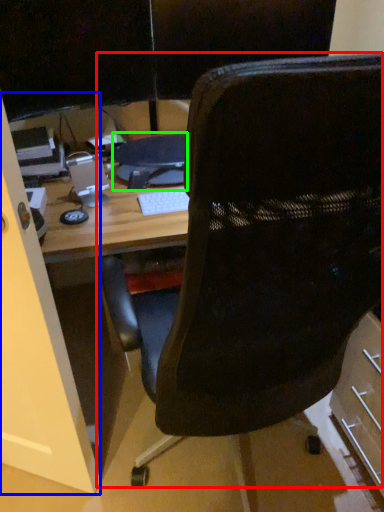
Question: Considering the real-world distances, which object is farthest from chair (highlighted by a red box)? glass door (highlighted by a blue box) or computer (highlighted by a green box)?

Choices:
 (A) glass door
 (B) computer

Answer: (B)